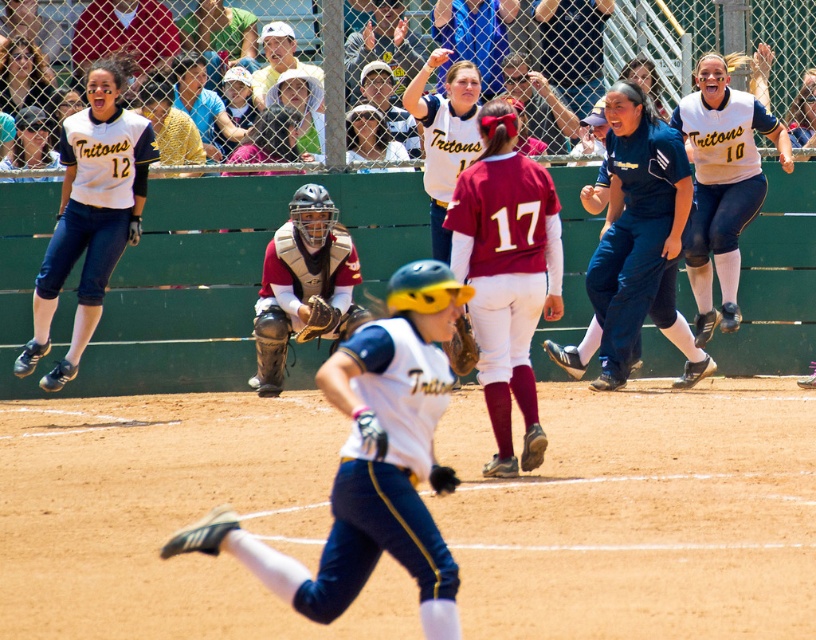
Based on the scene description, where is the white matte uniform at center located in terms of coordinates?

The white matte uniform at center is located at coordinates point (371, 461).

You are a photographer standing at the center of the softball field. You want to capture a photo of the matte black hair at upper left. Which direction should you point your camera to get the best shot?

The matte black hair at upper left is located at point 0.122 on the x axis and 0.028 on the y axis, so you should point your camera towards the upper left direction to capture it.